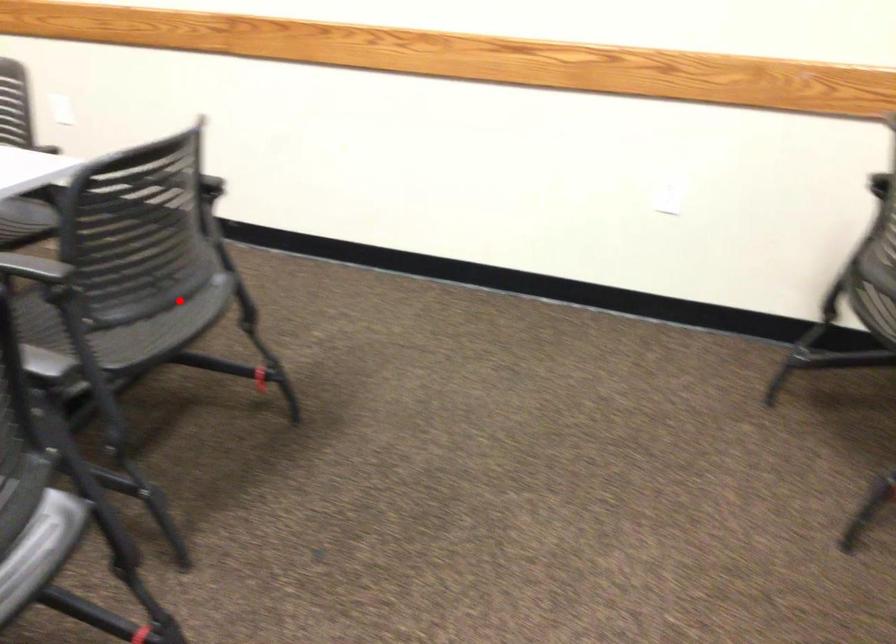
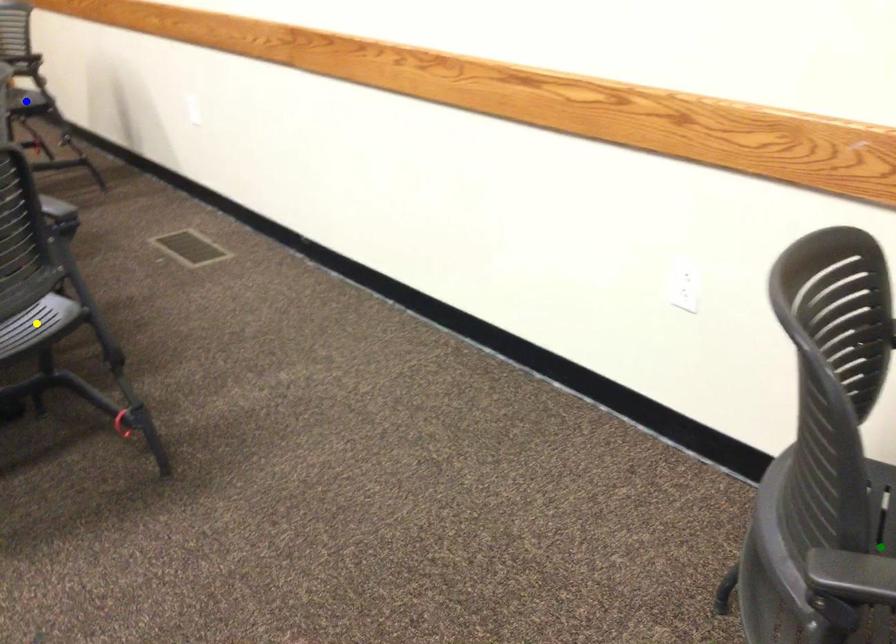
Question: I am providing you with two images of the same scene from different viewpoints. A red point is marked on the first image. You are given multiple points on the second image. Which spot in image 2 lines up with the point in image 1?

Choices:
 (A) green point
 (B) yellow point
 (C) blue point

Answer: (B)